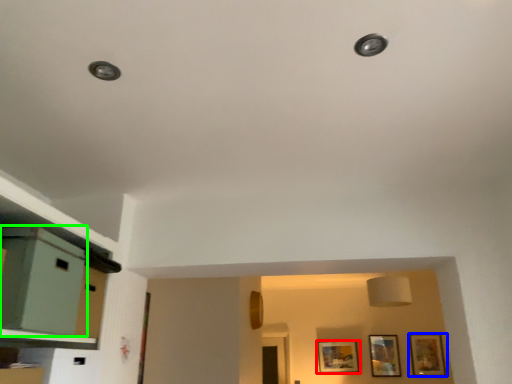
Question: Which is farther away from picture frame (highlighted by a red box)? picture frame (highlighted by a blue box) or file cabinet (highlighted by a green box)?

Choices:
 (A) picture frame
 (B) file cabinet

Answer: (B)